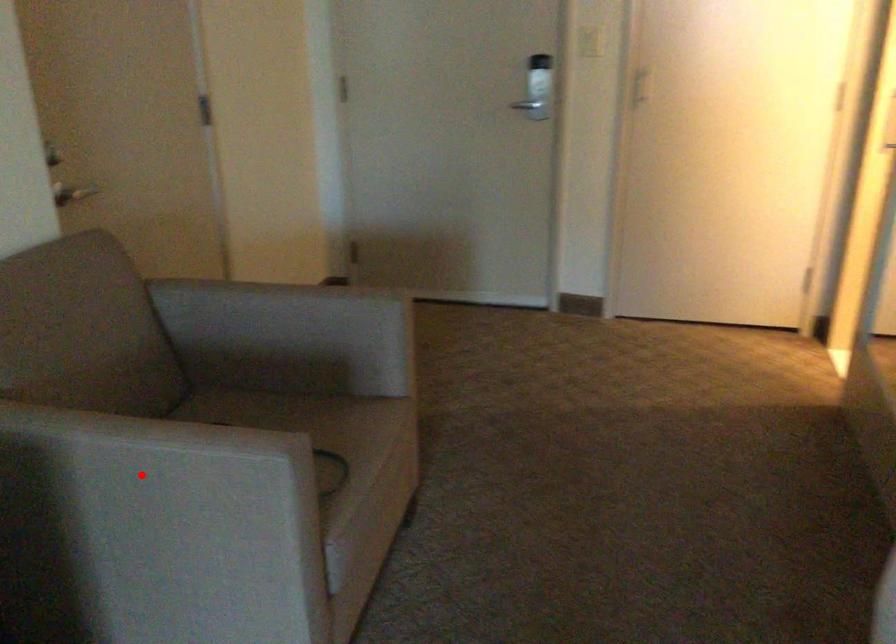
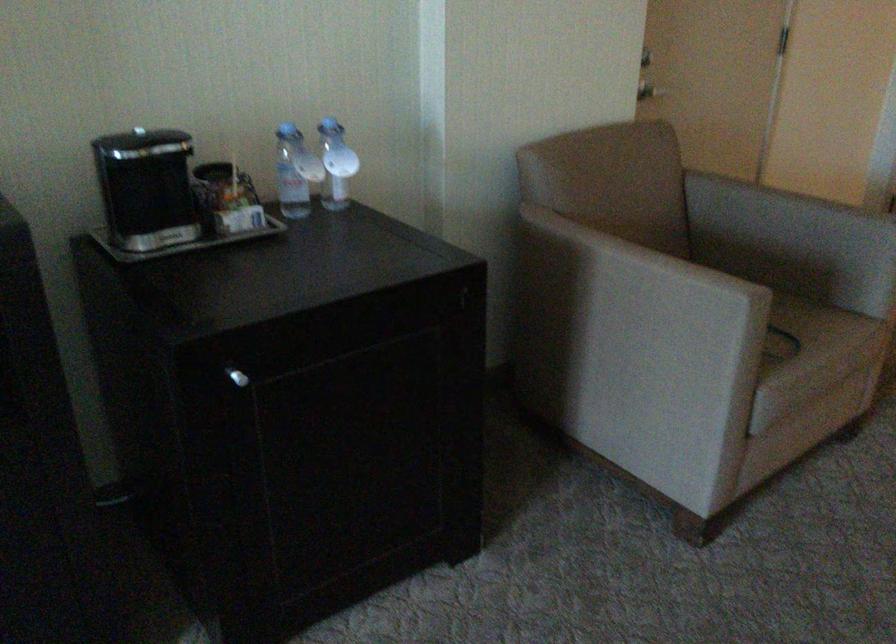
Question: I am providing you with two images of the same scene from different viewpoints. A red point is marked on the first image. At the location where the point appears in image 1, is it still visible in image 2?

Choices:
 (A) Yes
 (B) No

Answer: (A)